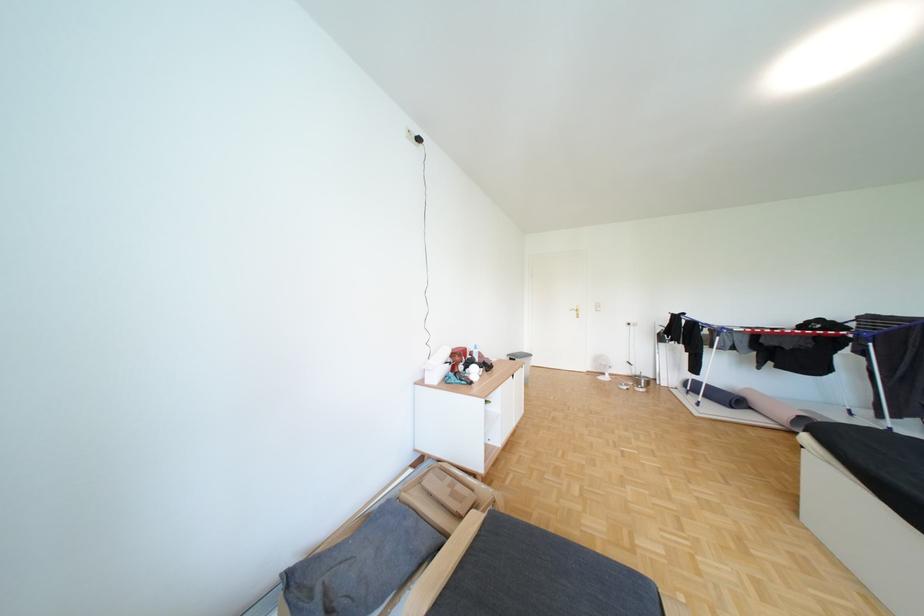
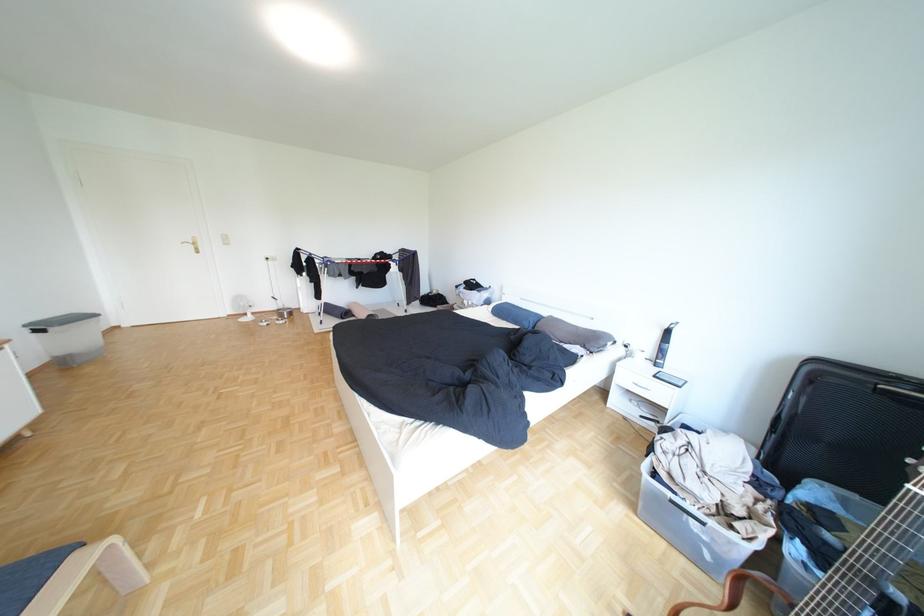
Locate, in the second image, the point that corresponds to pixel 528 360 in the first image.

(55, 331)